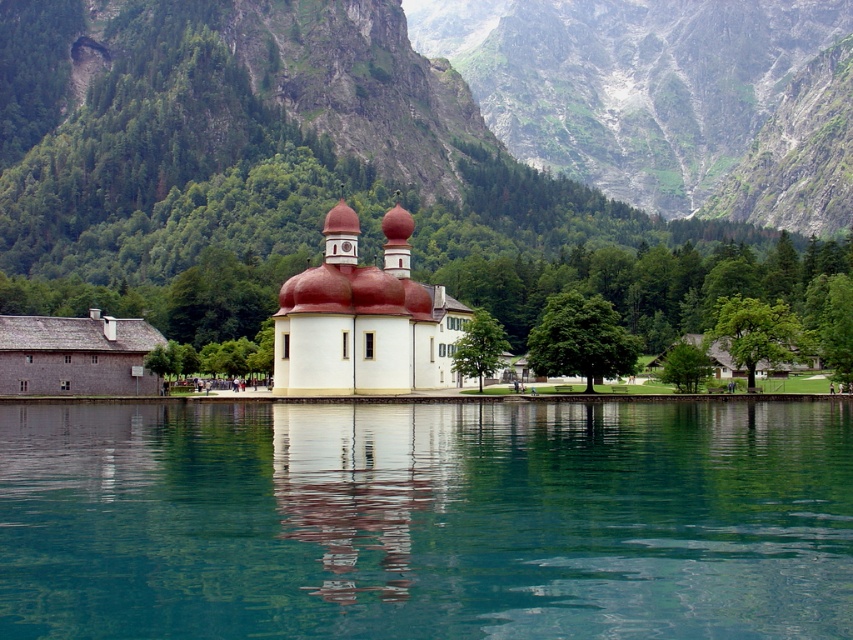
You are standing at the church entrance and want to take a photo of both point (624, 474) and point (370, 353). Which point should you focus on first to ensure both are in clear view?

You should focus on point (624, 474) first because it is closer to the camera than point (370, 353), ensuring both points are in clear view.